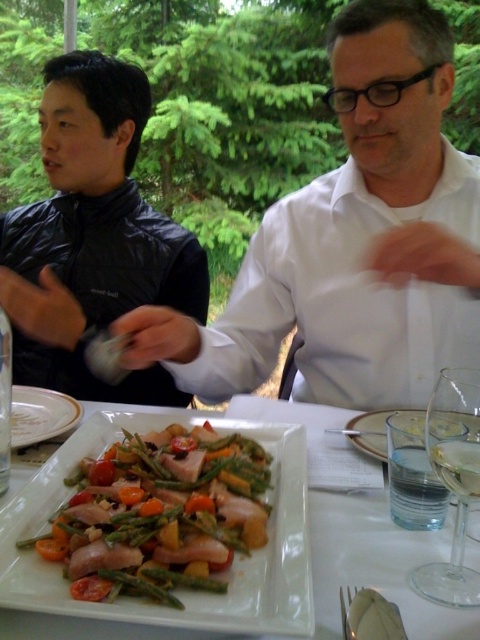
You are a photographer setting up a shoot in this outdoor dining area. You need to decide whether to position a light source closer to the white glossy shirt at upper center or the black leather jacket at left. Based on their heights, which item requires the light source to be placed closer to it?

The white glossy shirt at upper center is shorter than the black leather jacket at left, so the light source should be placed closer to the white glossy shirt at upper center to ensure proper illumination.

You are a waiter at an outdoor restaurant. You need to place a new drink order on the table. The customer specified it should be placed to the left of the shiny green asparagus at center. Where should you place the drink relative to the white porcelain plate at lower left?

The shiny green asparagus at center is to the right of the white porcelain plate at lower left, so placing the drink to the left of the shiny green asparagus at center means placing it to the right of the white porcelain plate at lower left.